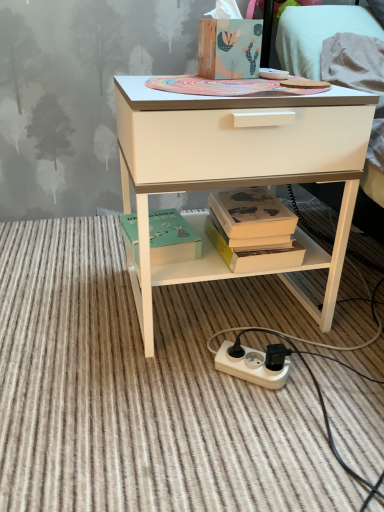
Locate an element on the screen. blank space to the left of white plastic power outlet at lower center is located at coordinates (171, 375).